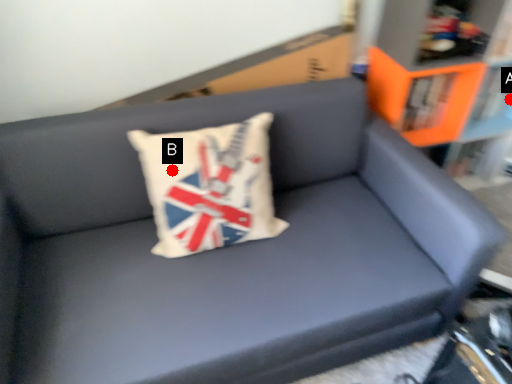
Question: Two points are circled on the image, labeled by A and B beside each circle. Which point is farther to the camera?

Choices:
 (A) A is further
 (B) B is further

Answer: (A)